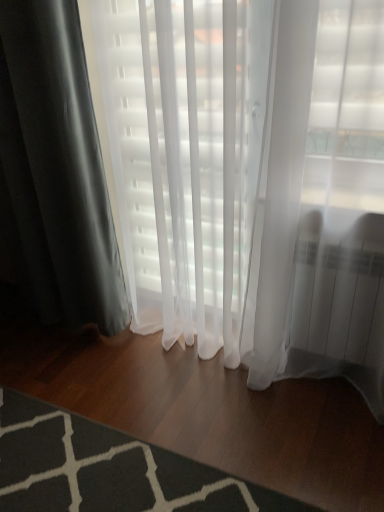
Question: From a real-world perspective, is matte black curtain at left above or below dark gray textured rug at lower left?

Choices:
 (A) below
 (B) above

Answer: (B)

Question: Is point (16, 259) positioned closer to the camera than point (215, 473)?

Choices:
 (A) closer
 (B) farther

Answer: (B)

Question: Would you say matte black curtain at left is inside or outside dark gray textured rug at lower left?

Choices:
 (A) outside
 (B) inside

Answer: (A)

Question: Is dark gray textured rug at lower left in front of or behind matte black curtain at left in the image?

Choices:
 (A) front
 (B) behind

Answer: (A)

Question: Which is correct: dark gray textured rug at lower left is inside matte black curtain at left, or outside of it?

Choices:
 (A) outside
 (B) inside

Answer: (A)

Question: From a real-world perspective, is dark gray textured rug at lower left above or below matte black curtain at left?

Choices:
 (A) above
 (B) below

Answer: (B)

Question: Is dark gray textured rug at lower left wider or thinner than matte black curtain at left?

Choices:
 (A) wide
 (B) thin

Answer: (A)